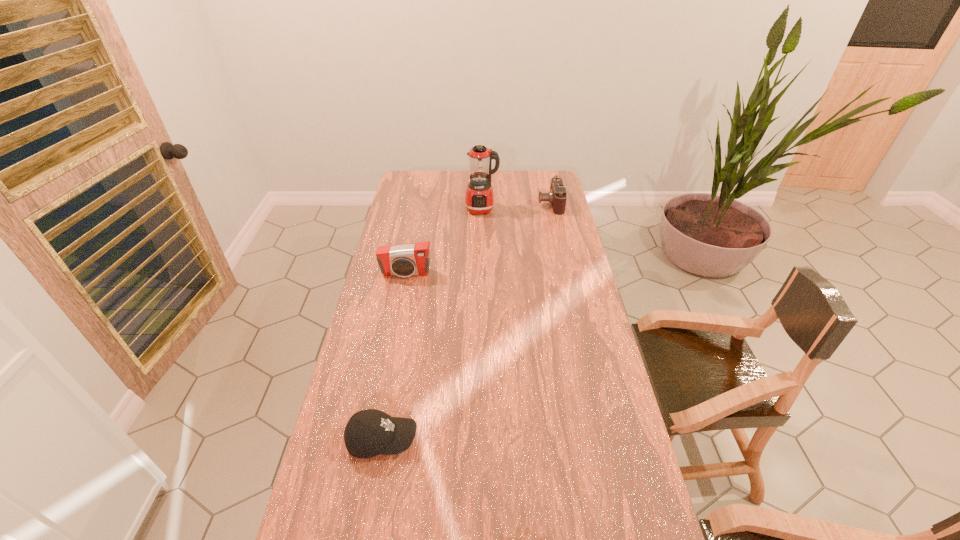
Image resolution: width=960 pixels, height=540 pixels. I want to click on food processor, so click(479, 198).

Find the location of `the second object from right to left`. the second object from right to left is located at coordinates (479, 198).

Image resolution: width=960 pixels, height=540 pixels. I want to click on the third farthest object, so click(413, 259).

This screenshot has height=540, width=960. Find the location of `the third shortest object`. the third shortest object is located at coordinates (413, 259).

Identify the location of the rightmost object. (557, 196).

Find the location of a particular element. This screenshot has width=960, height=540. the shorter camera is located at coordinates (557, 196).

Locate an element on the screen. Image resolution: width=960 pixels, height=540 pixels. baseball cap is located at coordinates (370, 432).

Locate an element on the screen. The width and height of the screenshot is (960, 540). vacant space situated 0.060m on the controls of the tallest object is located at coordinates (482, 225).

Locate an element on the screen. free space located 0.130m on the front-facing side of the nearer camera is located at coordinates (400, 304).

Locate an element on the screen. The height and width of the screenshot is (540, 960). vacant region located on the front-facing side of the farther camera is located at coordinates (515, 204).